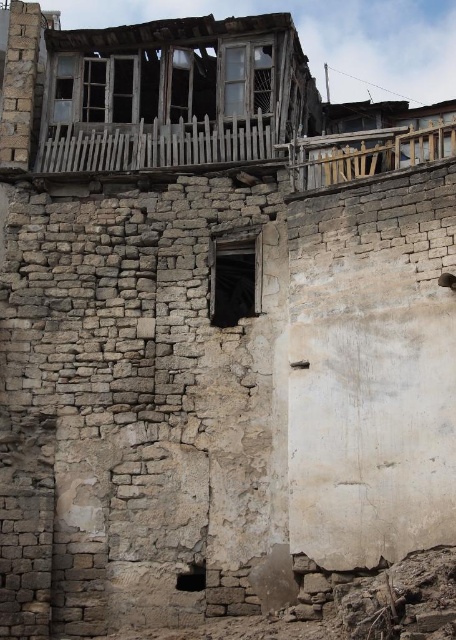
Between transparent glass window at center and transparent glass window at upper center, which one appears on the right side from the viewer's perspective?

From the viewer's perspective, transparent glass window at upper center appears more on the right side.

Does transparent glass window at center appear over transparent glass window at upper center?

Incorrect, transparent glass window at center is not positioned above transparent glass window at upper center.

This screenshot has height=640, width=456. Identify the location of transparent glass window at center. (234, 275).

The height and width of the screenshot is (640, 456). In order to click on transparent glass window at center in this screenshot , I will do `click(234, 275)`.